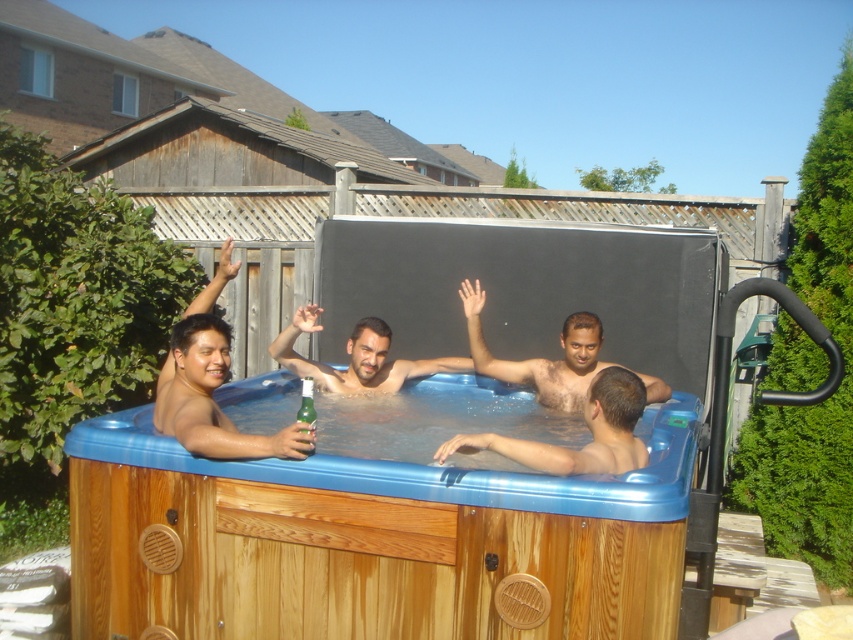
Does smooth skin man at center lie in front of matte blue hot tub at center?

Yes, it is in front of matte blue hot tub at center.

This screenshot has width=853, height=640. Find the location of `smooth skin man at center`. smooth skin man at center is located at coordinates [x=587, y=428].

Where is `smooth skin man at center`? smooth skin man at center is located at coordinates (587, 428).

This screenshot has width=853, height=640. I want to click on smooth skin man at center, so click(x=587, y=428).

Does matte black man at left have a greater height compared to smooth skin man at center?

Yes, matte black man at left is taller than smooth skin man at center.

You are a GUI agent. You are given a task and a screenshot of the screen. Output one action in this format:
    pyautogui.click(x=<x>, y=<y>)
    Task: Click on the matte black man at left
    
    Given the screenshot: What is the action you would take?
    pyautogui.click(x=212, y=397)

This screenshot has width=853, height=640. I want to click on matte black man at left, so click(x=212, y=397).

Is brown skin at center below green matte bottle at center?

Actually, brown skin at center is above green matte bottle at center.

Is brown skin at center above green matte bottle at center?

Yes.

Does point (653, 381) lie in front of point (303, 400)?

No, it is behind (303, 400).

This screenshot has width=853, height=640. What are the coordinates of `brown skin at center` in the screenshot? It's located at (538, 356).